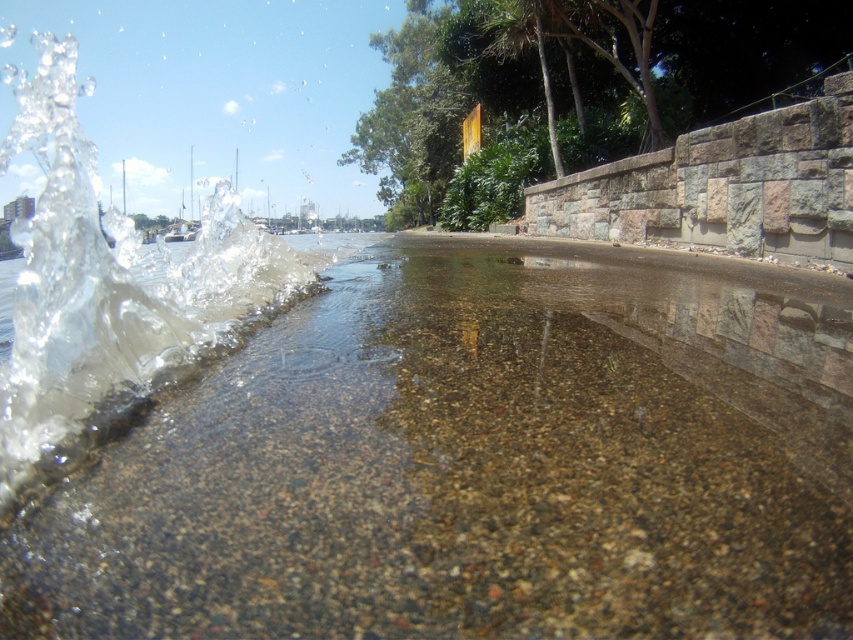
Is clear water at left smaller than clear liquid water at left?

Yes.

Is clear water at left wider than clear liquid water at left?

No, clear water at left is not wider than clear liquid water at left.

Describe the element at coordinates (474, 467) in the screenshot. The image size is (853, 640). I see `clear water at left` at that location.

The width and height of the screenshot is (853, 640). Identify the location of clear water at left. (474, 467).